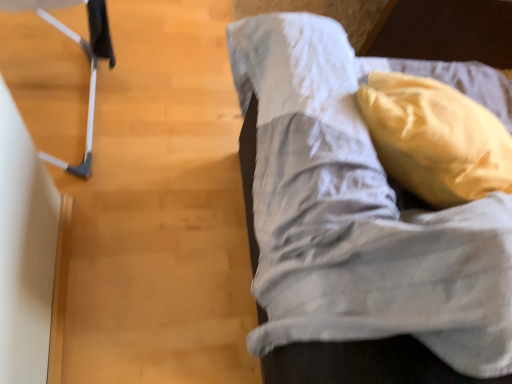
The width and height of the screenshot is (512, 384). Describe the element at coordinates (362, 207) in the screenshot. I see `textured gray fabric couch at right` at that location.

What are the coordinates of `textured gray fabric couch at right` in the screenshot? It's located at (362, 207).

This screenshot has width=512, height=384. I want to click on textured gray fabric couch at right, so click(362, 207).